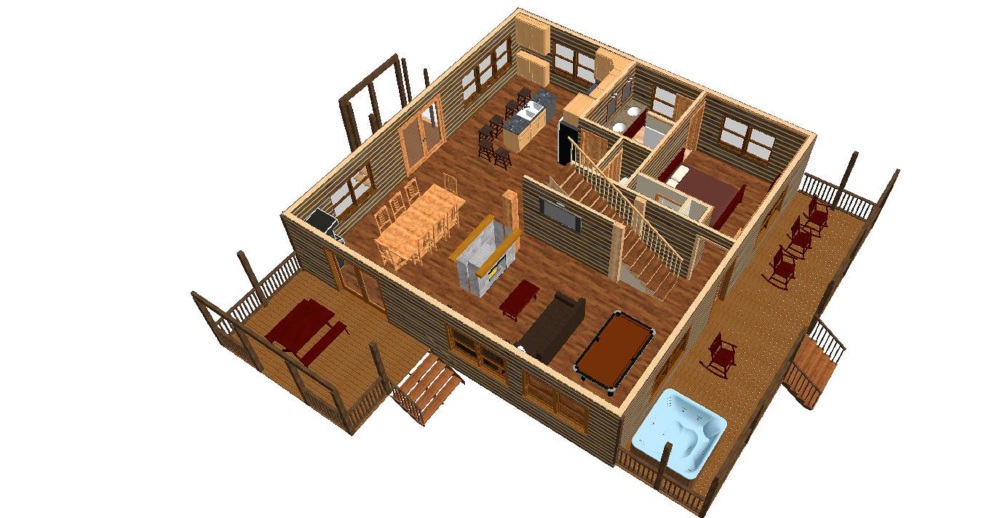
At what (x,y) coordinates should I click in order to perform the action: click on stairs. Please return your answer as a coordinate pair (x, y). Looking at the image, I should click on (812, 361), (436, 387), (644, 269).